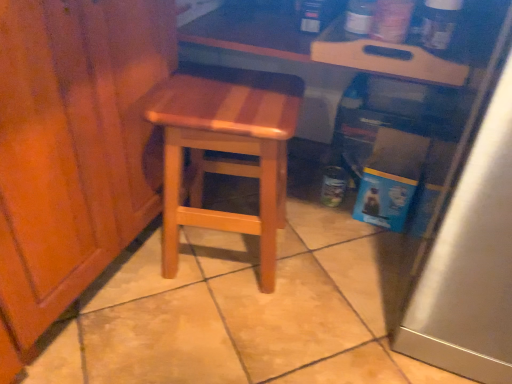
Question: In terms of size, does natural wood stool at center appear bigger or smaller than wooden tray at upper center?

Choices:
 (A) big
 (B) small

Answer: (A)

Question: From a real-world perspective, relative to wooden tray at upper center, is natural wood stool at center vertically above or below?

Choices:
 (A) below
 (B) above

Answer: (A)

Question: Considering the positions of natural wood stool at center and wooden tray at upper center in the image, is natural wood stool at center wider or thinner than wooden tray at upper center?

Choices:
 (A) thin
 (B) wide

Answer: (A)

Question: From the image's perspective, is wooden tray at upper center located above or below natural wood stool at center?

Choices:
 (A) below
 (B) above

Answer: (B)

Question: From a real-world perspective, relative to natural wood stool at center, is wooden tray at upper center vertically above or below?

Choices:
 (A) below
 (B) above

Answer: (B)

Question: Would you say wooden tray at upper center is to the left or to the right of natural wood stool at center in the picture?

Choices:
 (A) left
 (B) right

Answer: (B)

Question: Considering their positions, is wooden tray at upper center located in front of or behind natural wood stool at center?

Choices:
 (A) front
 (B) behind

Answer: (B)